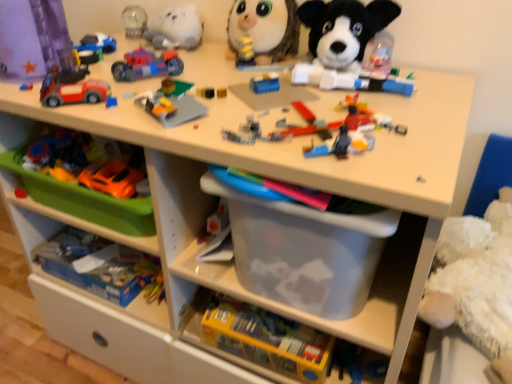
Find the location of a particular element. The image size is (512, 384). free point below translucent plastic bricks at center, which is counted as the fourth toy, starting from the bottom (from a real-world perspective) is located at coordinates (311, 123).